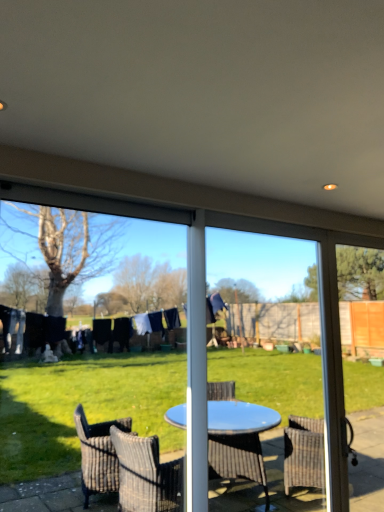
I want to click on blue plastic table at center, positioned as the 1th screen door in left-to-right order, so click(266, 319).

Considering the positions of point (278, 312) and point (360, 328), is point (278, 312) closer or farther from the camera than point (360, 328)?

Point (278, 312) is positioned farther from the camera compared to point (360, 328).

Is blue plastic table at center, the 2th screen door in the right-to-left sequence, touching transparent glass screen door at right, the second screen door when ordered from left to right?

No, blue plastic table at center, the 2th screen door in the right-to-left sequence, is not next to transparent glass screen door at right, the second screen door when ordered from left to right.

Considering the relative sizes of blue plastic table at center, the 2th screen door in the right-to-left sequence, and transparent glass screen door at right, which appears as the 1th screen door when viewed from the right, in the image provided, is blue plastic table at center, the 2th screen door in the right-to-left sequence, thinner than transparent glass screen door at right, which appears as the 1th screen door when viewed from the right,?

Yes, blue plastic table at center, the 2th screen door in the right-to-left sequence, is thinner than transparent glass screen door at right, which appears as the 1th screen door when viewed from the right.

From a real-world perspective, count 1st screen doors downward from the transparent plastic screen at center and point to it. Please provide its 2D coordinates.

[(266, 319)]

Would you say transparent plastic screen at center is to the left or to the right of blue plastic table at center, positioned as the 1th screen door in left-to-right order, in the picture?

transparent plastic screen at center is to the left of blue plastic table at center, positioned as the 1th screen door in left-to-right order.

Considering the sizes of objects transparent plastic screen at center and blue plastic table at center, positioned as the 1th screen door in left-to-right order, in the image provided, who is shorter, transparent plastic screen at center or blue plastic table at center, positioned as the 1th screen door in left-to-right order,?

transparent plastic screen at center.

Is transparent plastic screen at center positioned before blue plastic table at center, the 2th screen door in the right-to-left sequence?

That is True.

Between blue plastic table at center, the 2th screen door in the right-to-left sequence, and transparent plastic screen at center, which one has smaller width?

With smaller width is transparent plastic screen at center.

Is point (207, 356) positioned behind point (144, 381)?

No, (207, 356) is closer to viewer.

Does blue plastic table at center, the 2th screen door in the right-to-left sequence, have a greater height compared to transparent plastic screen at center?

Correct, blue plastic table at center, the 2th screen door in the right-to-left sequence, is much taller as transparent plastic screen at center.

Is blue plastic table at center, positioned as the 1th screen door in left-to-right order, facing away from transparent plastic screen at center?

No.

Which point is more forward, (115, 393) or (371, 268)?

The point (371, 268) is more forward.

From the picture: Could you tell me if transparent plastic screen at center is facing transparent glass screen door at right, the second screen door when ordered from left to right?

No, transparent plastic screen at center is not oriented towards transparent glass screen door at right, the second screen door when ordered from left to right.

Is transparent plastic screen at center taller than transparent glass screen door at right, which appears as the 1th screen door when viewed from the right?

No, transparent plastic screen at center is not taller than transparent glass screen door at right, which appears as the 1th screen door when viewed from the right.

Looking at this image, is transparent plastic screen at center located outside transparent glass screen door at right, which appears as the 1th screen door when viewed from the right?

Absolutely, transparent plastic screen at center is external to transparent glass screen door at right, which appears as the 1th screen door when viewed from the right.

Could you tell me if transparent glass screen door at right, which appears as the 1th screen door when viewed from the right, is turned towards blue plastic table at center, the 2th screen door in the right-to-left sequence?

No, transparent glass screen door at right, which appears as the 1th screen door when viewed from the right, is not aimed at blue plastic table at center, the 2th screen door in the right-to-left sequence.

From a real-world perspective, is transparent glass screen door at right, the second screen door when ordered from left to right, located beneath blue plastic table at center, the 2th screen door in the right-to-left sequence?

Indeed, from a real-world perspective, transparent glass screen door at right, the second screen door when ordered from left to right, is positioned beneath blue plastic table at center, the 2th screen door in the right-to-left sequence.

Relative to blue plastic table at center, the 2th screen door in the right-to-left sequence, is transparent glass screen door at right, which appears as the 1th screen door when viewed from the right, in front or behind?

transparent glass screen door at right, which appears as the 1th screen door when viewed from the right, is positioned farther from the viewer than blue plastic table at center, the 2th screen door in the right-to-left sequence.

Does transparent glass screen door at right, which appears as the 1th screen door when viewed from the right, have a greater width compared to blue plastic table at center, positioned as the 1th screen door in left-to-right order?

Correct, the width of transparent glass screen door at right, which appears as the 1th screen door when viewed from the right, exceeds that of blue plastic table at center, positioned as the 1th screen door in left-to-right order.

Find the location of `window screen located above the transparent glass screen door at right, the second screen door when ordered from left to right (from the image's perspective)`. window screen located above the transparent glass screen door at right, the second screen door when ordered from left to right (from the image's perspective) is located at coordinates (89, 264).

Measure the distance from transparent glass screen door at right, which appears as the 1th screen door when viewed from the right, to transparent plastic screen at center.

transparent glass screen door at right, which appears as the 1th screen door when viewed from the right, and transparent plastic screen at center are 23.03 feet apart from each other.

Are transparent glass screen door at right, which appears as the 1th screen door when viewed from the right, and transparent plastic screen at center located far from each other?

Indeed, transparent glass screen door at right, which appears as the 1th screen door when viewed from the right, is not near transparent plastic screen at center.

From the image's perspective, which is below, transparent glass screen door at right, the second screen door when ordered from left to right, or transparent plastic screen at center?

transparent glass screen door at right, the second screen door when ordered from left to right, is shown below in the image.

You are a GUI agent. You are given a task and a screenshot of the screen. Output one action in this format:
    pyautogui.click(x=<x>, y=<y>)
    Task: Click on the screen door above the transparent glass screen door at right, the second screen door when ordered from left to right (from the image's perspective)
    This screenshot has height=512, width=384.
    Given the screenshot: What is the action you would take?
    pyautogui.click(x=266, y=319)

This screenshot has height=512, width=384. Identify the location of window screen above the blue plastic table at center, the 2th screen door in the right-to-left sequence (from a real-world perspective). (89, 264).

When comparing their distances from blue plastic table at center, positioned as the 1th screen door in left-to-right order, does transparent glass screen door at right, the second screen door when ordered from left to right, or transparent plastic screen at center seem further?

transparent glass screen door at right, the second screen door when ordered from left to right, is further to blue plastic table at center, positioned as the 1th screen door in left-to-right order.

Considering their positions, is blue plastic table at center, positioned as the 1th screen door in left-to-right order, positioned closer to transparent plastic screen at center than transparent glass screen door at right, which appears as the 1th screen door when viewed from the right?

blue plastic table at center, positioned as the 1th screen door in left-to-right order, is closer to transparent plastic screen at center.

Looking at the image, which one is located further to blue plastic table at center, positioned as the 1th screen door in left-to-right order, transparent plastic screen at center or transparent glass screen door at right, which appears as the 1th screen door when viewed from the right?

Among the two, transparent glass screen door at right, which appears as the 1th screen door when viewed from the right, is located further to blue plastic table at center, positioned as the 1th screen door in left-to-right order.

Considering their positions, is transparent plastic screen at center positioned closer to transparent glass screen door at right, the second screen door when ordered from left to right, than blue plastic table at center, the 2th screen door in the right-to-left sequence?

Based on the image, blue plastic table at center, the 2th screen door in the right-to-left sequence, appears to be nearer to transparent glass screen door at right, the second screen door when ordered from left to right.

Consider the image. When comparing their distances from transparent glass screen door at right, which appears as the 1th screen door when viewed from the right, does blue plastic table at center, positioned as the 1th screen door in left-to-right order, or transparent plastic screen at center seem further?

Based on the image, transparent plastic screen at center appears to be further to transparent glass screen door at right, which appears as the 1th screen door when viewed from the right.

When comparing their distances from transparent plastic screen at center, does transparent glass screen door at right, which appears as the 1th screen door when viewed from the right, or blue plastic table at center, the 2th screen door in the right-to-left sequence, seem further?

Among the two, transparent glass screen door at right, which appears as the 1th screen door when viewed from the right, is located further to transparent plastic screen at center.

Image resolution: width=384 pixels, height=512 pixels. In order to click on screen door between transparent plastic screen at center and transparent glass screen door at right, which appears as the 1th screen door when viewed from the right, from left to right in this screenshot , I will do `click(266, 319)`.